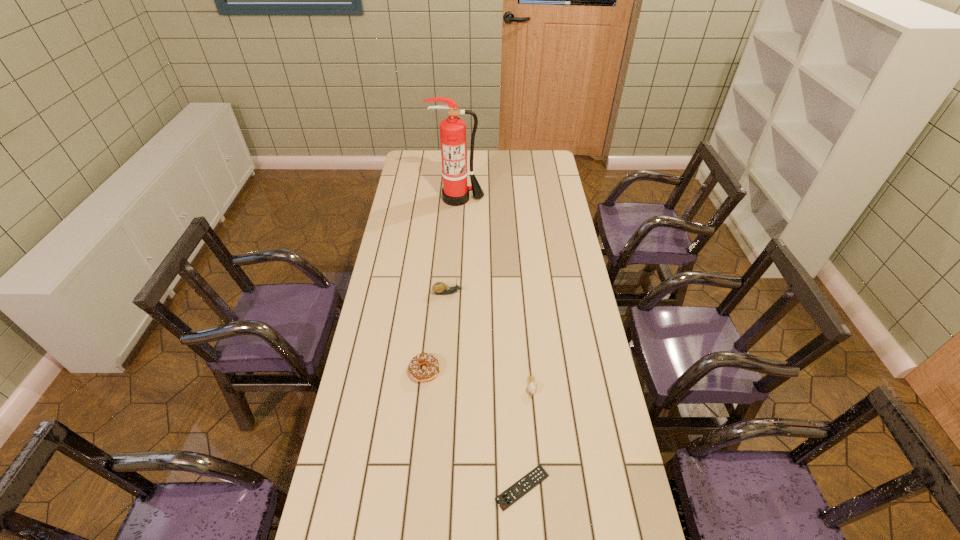
Where is `vacant region that satisfies the following two spatial constraints: 1. on the front-facing side of the left escargot; 2. on the right side of the shortest object`? The height and width of the screenshot is (540, 960). vacant region that satisfies the following two spatial constraints: 1. on the front-facing side of the left escargot; 2. on the right side of the shortest object is located at coordinates (434, 488).

Image resolution: width=960 pixels, height=540 pixels. Identify the location of free space that satisfies the following two spatial constraints: 1. on the back side of the remote control; 2. on the front-facing side of the fourth nearest object. (510, 293).